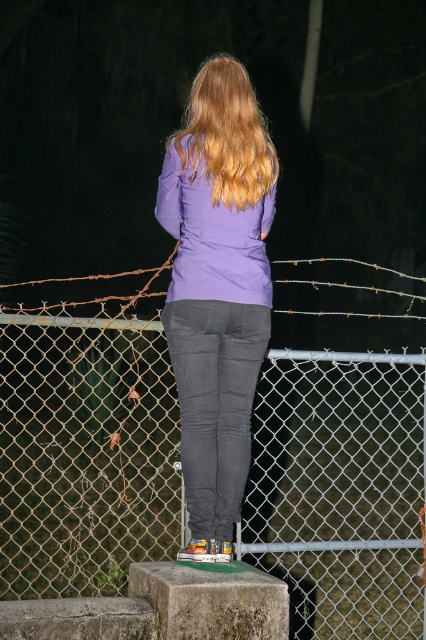
You are a photographer trying to capture the golden wavy hair at back and the wire mesh fence at center in the same frame. Which object is closer to the camera based on their positions?

The golden wavy hair at back is behind the wire mesh fence at center, so the wire mesh fence at center is closer to the camera.

You are a photographer trying to capture the person in the image. Since the purple matte sweatshirt at center and the golden wavy hair at back are important elements, can you position yourself so that both are visible in the frame without moving the subject? Explain your reasoning based on their positions.

The purple matte sweatshirt at center is to the left of the golden wavy hair at back. Since the sweatshirt is positioned to the left of the hair, you can position yourself to the right side of the subject to ensure both elements are visible in the frame without moving them.